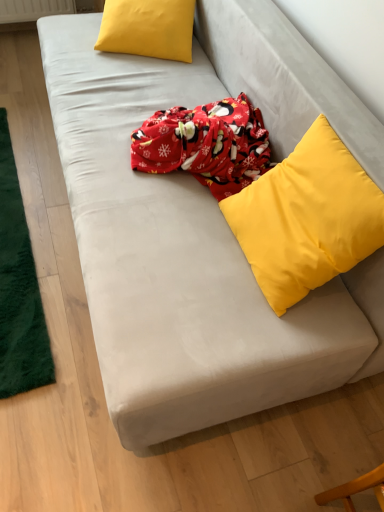
Question: From a real-world perspective, does matte yellow pillow at upper left, which ranks as the second pillow in front-to-back order, stand above green plush mat at left?

Choices:
 (A) no
 (B) yes

Answer: (B)

Question: Does matte yellow pillow at upper left, which ranks as the second pillow in front-to-back order, contain green plush mat at left?

Choices:
 (A) no
 (B) yes

Answer: (A)

Question: Is matte yellow pillow at upper left, marked as the 2th pillow in a right-to-left arrangement, further to the viewer compared to green plush mat at left?

Choices:
 (A) yes
 (B) no

Answer: (A)

Question: Could you tell me if matte yellow pillow at upper left, the 1th pillow from the back, is facing green plush mat at left?

Choices:
 (A) yes
 (B) no

Answer: (B)

Question: Is the surface of matte yellow pillow at upper left, the 1th pillow from the back, in direct contact with green plush mat at left?

Choices:
 (A) yes
 (B) no

Answer: (B)

Question: Does matte yellow pillow at upper left, which is counted as the 2th pillow, starting from the bottom, have a greater width compared to green plush mat at left?

Choices:
 (A) yes
 (B) no

Answer: (B)

Question: Does yellow matte pillow at upper right, the second pillow viewed from the back, turn towards matte yellow pillow at upper left, marked as the 2th pillow in a right-to-left arrangement?

Choices:
 (A) no
 (B) yes

Answer: (A)

Question: Can you confirm if yellow matte pillow at upper right, the 2th pillow from the top, is wider than matte yellow pillow at upper left, which appears as the first pillow when viewed from the top?

Choices:
 (A) yes
 (B) no

Answer: (B)

Question: Is yellow matte pillow at upper right, the second pillow viewed from the back, turned away from matte yellow pillow at upper left, the 1th pillow from the back?

Choices:
 (A) yes
 (B) no

Answer: (B)

Question: Is yellow matte pillow at upper right, which ranks as the first pillow in right-to-left order, with matte yellow pillow at upper left, marked as the 2th pillow in a right-to-left arrangement?

Choices:
 (A) yes
 (B) no

Answer: (B)

Question: Does yellow matte pillow at upper right, the 2th pillow from the top, have a lesser height compared to matte yellow pillow at upper left, the 1th pillow when ordered from left to right?

Choices:
 (A) yes
 (B) no

Answer: (B)

Question: From the image's perspective, would you say yellow matte pillow at upper right, the second pillow viewed from the back, is positioned over matte yellow pillow at upper left, which is counted as the 2th pillow, starting from the bottom?

Choices:
 (A) no
 (B) yes

Answer: (A)

Question: Considering the relative sizes of green plush mat at left and matte yellow pillow at upper left, the 1th pillow from the back, in the image provided, is green plush mat at left wider than matte yellow pillow at upper left, the 1th pillow from the back,?

Choices:
 (A) yes
 (B) no

Answer: (A)